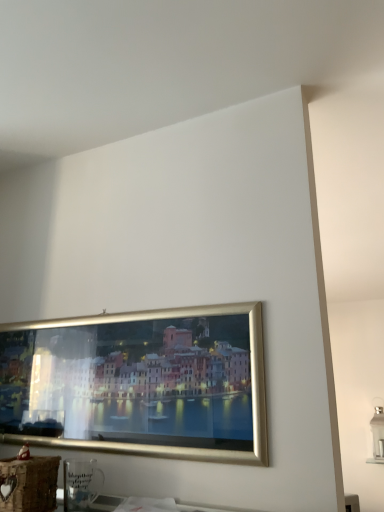
Locate an element on the screen. Image resolution: width=384 pixels, height=512 pixels. brown woven basket at lower left is located at coordinates tap(29, 484).

This screenshot has width=384, height=512. What do you see at coordinates (29, 484) in the screenshot?
I see `brown woven basket at lower left` at bounding box center [29, 484].

Find the location of `brown woven basket at lower left`. brown woven basket at lower left is located at coordinates click(x=29, y=484).